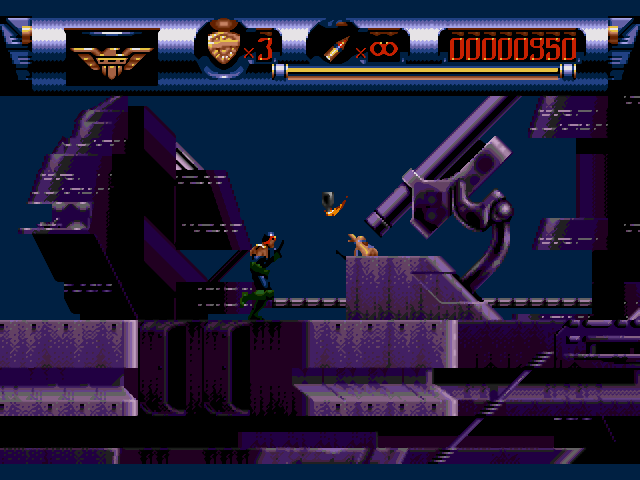
This screenshot has width=640, height=480. What are the coordinates of `wall` in the screenshot? It's located at (365, 370).